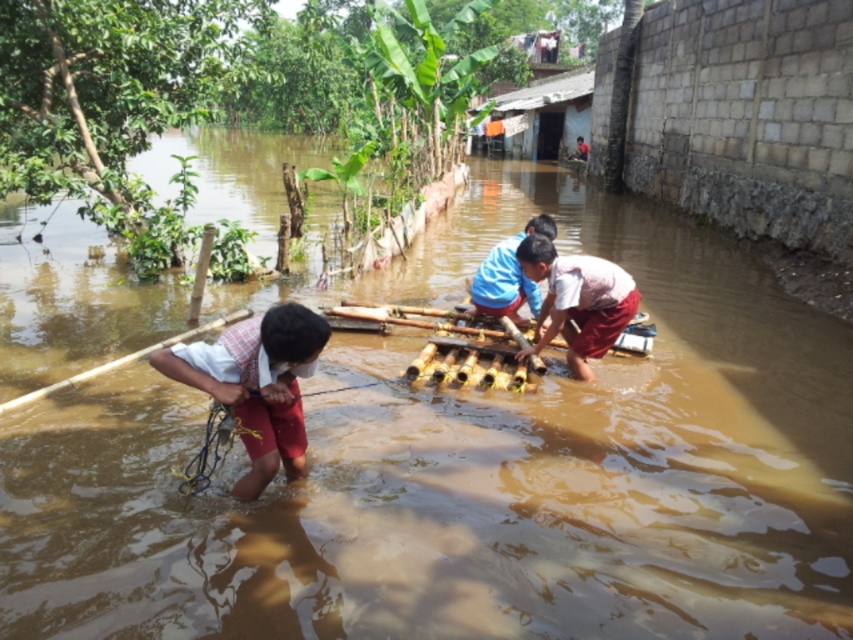
You are a rescue worker trying to reach a stranded person on the other side of the flooded area. You have a 3 meter long rope. You see the white cotton shirt at lower left and the pink fabric at center. Can you use the rope to connect them?

The white cotton shirt at lower left and the pink fabric at center are 2.78 meters apart from each other. Since the rope is 3 meters long, it is longer than the distance between them, so yes, you can use the rope to connect them.

You are a photographer trying to capture the scene of the flooded area. You notice two items of clothing in the image. Which item is positioned to the left of the other? The white cotton shirt at lower left and the pink fabric at center are both visible in the frame.

The white cotton shirt at lower left is positioned to the left of the pink fabric at center.

You are a rescue worker trying to locate two items in the flooded area. You see a white cotton shirt at lower left and a pink fabric at center. Which item is positioned lower in the image?

The white cotton shirt at lower left is located below the pink fabric at center, so the white cotton shirt at lower left is positioned lower in the image.